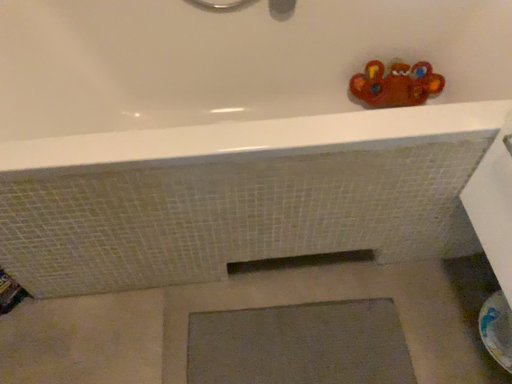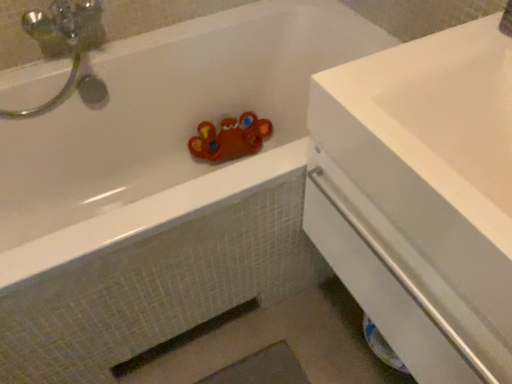
Question: How did the camera likely rotate when shooting the video?

Choices:
 (A) rotated downward
 (B) rotated upward

Answer: (B)